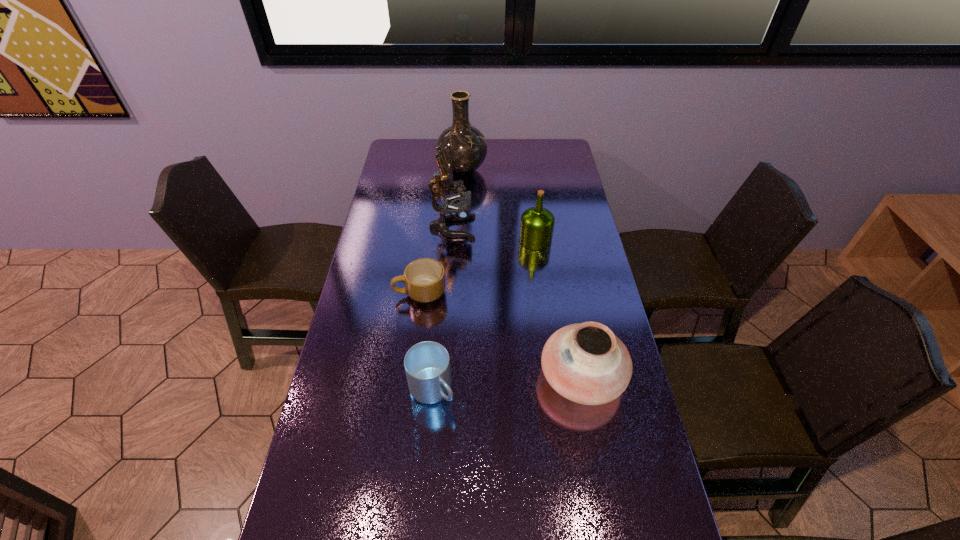
Locate an element on the screen. This screenshot has width=960, height=540. the farthest object is located at coordinates point(465,147).

At what (x,y) coordinates should I click in order to perform the action: click on microscope. Please return your answer as a coordinate pair (x, y). Looking at the image, I should click on (443, 180).

Where is `olive oil`? olive oil is located at coordinates (537, 223).

This screenshot has width=960, height=540. In order to click on the third shortest object in this screenshot , I will do `click(586, 363)`.

This screenshot has height=540, width=960. In order to click on the nearer mug in this screenshot , I will do `click(427, 364)`.

This screenshot has height=540, width=960. I want to click on the second shortest object, so click(427, 364).

Where is `the shorter mug`? This screenshot has width=960, height=540. the shorter mug is located at coordinates coord(424,278).

Locate an element on the screen. the shortest object is located at coordinates (424, 278).

Where is `free location located on the back of the vase`? free location located on the back of the vase is located at coordinates (464, 148).

This screenshot has height=540, width=960. In order to click on free space located at the eyepieces of the microscope in this screenshot , I will do `click(557, 228)`.